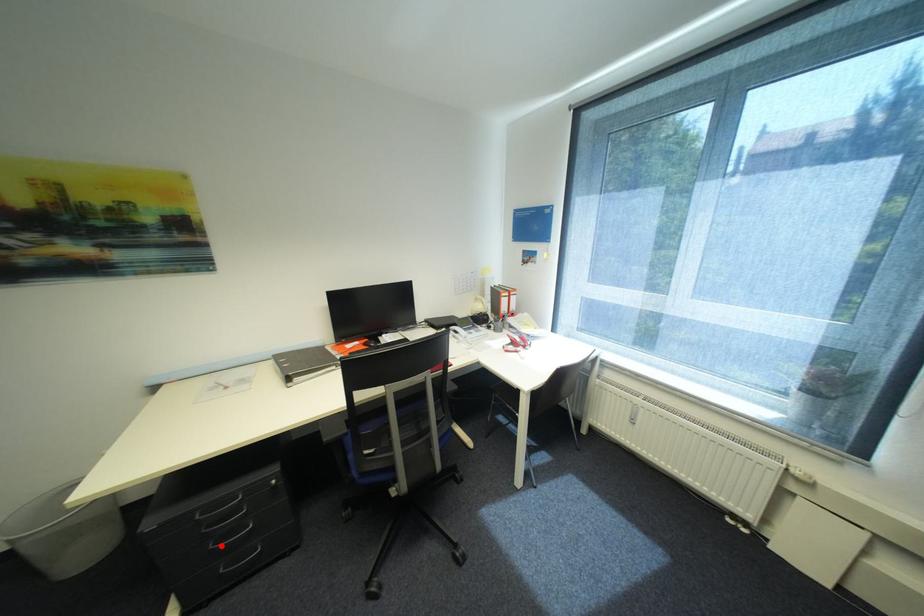
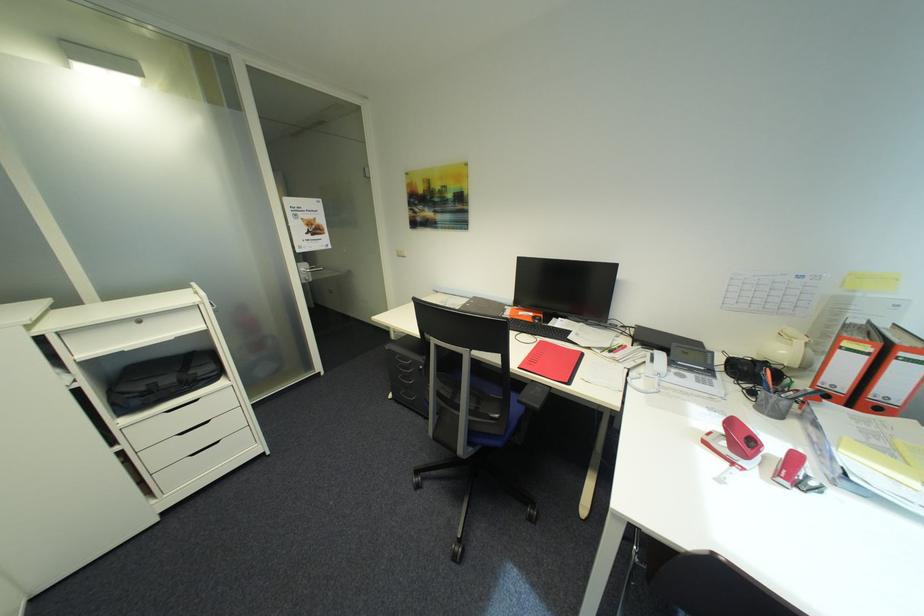
Locate, in the second image, the point that corresponds to the highlighted location in the first image.

(408, 378)